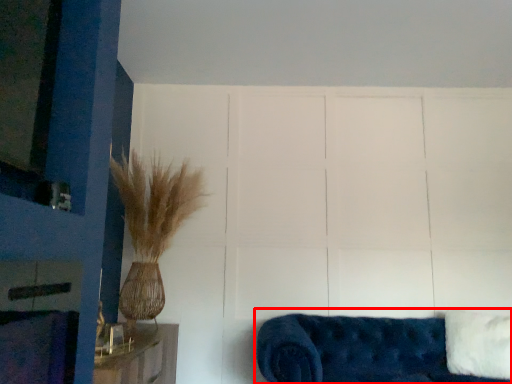
Question: From the image, what is the correct spatial relationship of studio couch (annotated by the red box) in relation to pillow?

Choices:
 (A) right
 (B) left

Answer: (B)